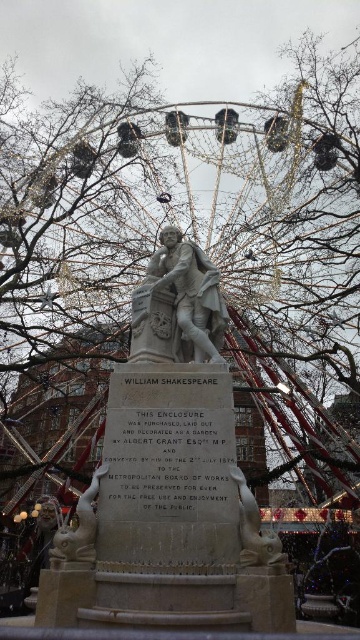
You are a visitor in the public square and want to take a photo of the white marble statue at center without any obstruction. Is the bare branches at center blocking the view of the statue?

The bare branches at center is much taller than the white marble statue at center, so the branches are likely blocking the view of the statue. You may need to move to a different angle or position to capture an unobstructed photo.

You are a painter who wants to paint the statue of Shakespeare. You have two brushes available. One is large enough to cover wide areas, and the other is small for details. Based on the scene, which brush should you use for the bare branches at center and the white marble lion at lower left?

The bare branches at center might be wider than the white marble lion at lower left, so use the large brush for the bare branches at center and the small brush for the white marble lion at lower left.

You are standing in the public square where the Shakespeare statue is located. You see a point marked at coordinates (69, 216). What is located at that point?

The point at coordinates (69, 216) corresponds to bare branches at center.